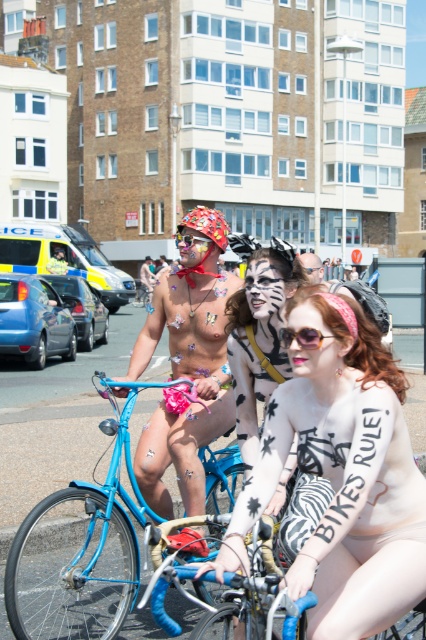
You are a photographer trying to capture the perfect shot of the matte black sunglasses at center. The sunglasses are positioned at coordinates point 0.497, 0.714. If you want to frame the sunglasses precisely, which part of the image should you focus on?

The matte black sunglasses at center is located at point (304, 317), so you should focus on that coordinate to frame them precisely.

You are a photographer taking a picture of the zebra print face paint at center and the matte black sunglasses at center. Based on their positions, which one should you focus on first to capture both in the frame?

The zebra print face paint at center is located above the matte black sunglasses at center, so you should focus on the zebra print face paint at center first to ensure both are in the frame.